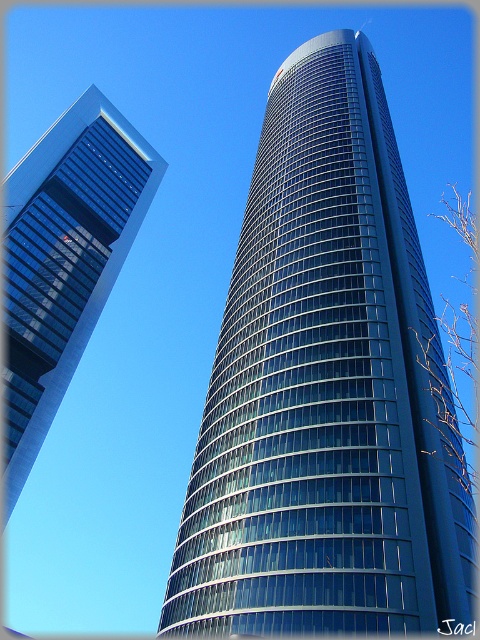
Can you confirm if glassy blue skyscraper at center is smaller than glassy blue skyscraper at left?

No, glassy blue skyscraper at center is not smaller than glassy blue skyscraper at left.

The image size is (480, 640). What do you see at coordinates (325, 388) in the screenshot?
I see `glassy blue skyscraper at center` at bounding box center [325, 388].

Is point (452, 525) less distant than point (120, 264)?

Yes, it is in front of point (120, 264).

Locate an element on the screen. The width and height of the screenshot is (480, 640). glassy blue skyscraper at center is located at coordinates (325, 388).